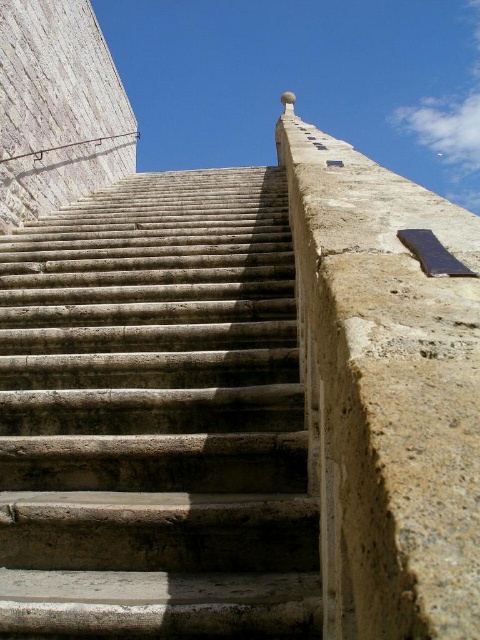
Question: Which of these objects is positioned farthest from the gray stone stairs at center?

Choices:
 (A) smooth beige concrete at upper left
 (B) smooth beige concrete at right

Answer: (A)

Question: Based on their relative distances, which object is nearer to the smooth beige concrete at right?

Choices:
 (A) gray stone stairs at center
 (B) smooth beige concrete at upper left

Answer: (A)

Question: Is smooth beige concrete at right positioned in front of smooth beige concrete at upper left?

Choices:
 (A) no
 (B) yes

Answer: (B)

Question: Is gray stone stairs at center wider than smooth beige concrete at right?

Choices:
 (A) yes
 (B) no

Answer: (A)

Question: Which object appears farthest from the camera in this image?

Choices:
 (A) smooth beige concrete at upper left
 (B) smooth beige concrete at right

Answer: (A)

Question: Can you confirm if gray stone stairs at center is positioned below smooth beige concrete at right?

Choices:
 (A) yes
 (B) no

Answer: (A)